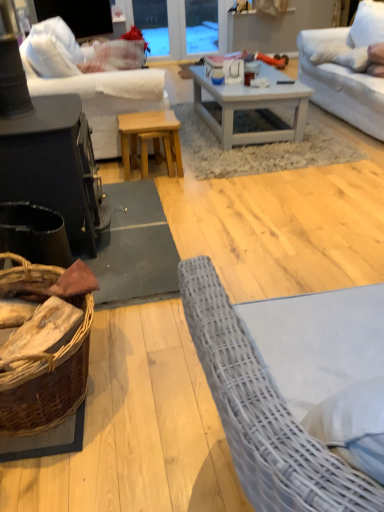
Question: Considering the positions of transparent glass door at upper center and natural wood stool at center, the second table from the front, in the image, is transparent glass door at upper center wider or thinner than natural wood stool at center, the second table from the front,?

Choices:
 (A) thin
 (B) wide

Answer: (A)

Question: From a real-world perspective, relative to natural wood stool at center, the second table from the front, is transparent glass door at upper center vertically above or below?

Choices:
 (A) above
 (B) below

Answer: (A)

Question: Estimate the real-world distances between objects in this image. Which object is farther from the black matte wood table at left, the first table viewed from the front?

Choices:
 (A) natural wood stool at center, the second table from the front
 (B) white fabric couch at upper right, which is the second studio couch in left-to-right order
 (C) transparent glass door at upper center
 (D) white fabric couch at upper left, which is the 1th studio couch in left-to-right order
 (E) brown woven basket at lower left

Answer: (C)

Question: Considering the real-world distances, which object is closest to the natural wood stool at center, positioned as the 1th table in back-to-front order?

Choices:
 (A) brown woven basket at lower left
 (B) white wooden coffee table at center
 (C) transparent glass door at upper center
 (D) white fabric couch at upper right, the first studio couch positioned from the right
 (E) black matte wood table at left, which appears as the second table when viewed from the back

Answer: (B)